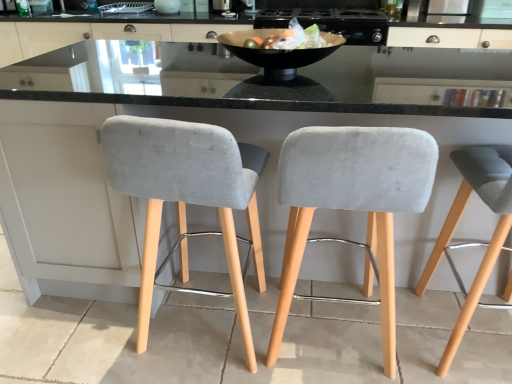
What do you see at coordinates (286, 100) in the screenshot? I see `matte white cabinet at upper center` at bounding box center [286, 100].

The height and width of the screenshot is (384, 512). I want to click on metallic black pan at upper center, placed as the first appliance when sorted from right to left, so click(332, 22).

Image resolution: width=512 pixels, height=384 pixels. What do you see at coordinates (277, 53) in the screenshot?
I see `black glossy bowl at center` at bounding box center [277, 53].

Locate an element on the screen. This screenshot has height=384, width=512. matte white cabinet at upper center is located at coordinates (286, 100).

Considering the positions of points (155, 5) and (280, 58), is point (155, 5) farther from camera compared to point (280, 58)?

Yes.

Between white glossy bowl at upper center, which is the first appliance in left-to-right order, and black glossy bowl at center, which one has larger width?

black glossy bowl at center.

From the image's perspective, does white glossy bowl at upper center, which is the 2th appliance in right-to-left order, appear lower than black glossy bowl at center?

Actually, white glossy bowl at upper center, which is the 2th appliance in right-to-left order, appears above black glossy bowl at center in the image.

How far apart are velvet grey chair at center, placed as the second chair when sorted from left to right, and matte white cabinet at upper center?

velvet grey chair at center, placed as the second chair when sorted from left to right, is 1.90 meters away from matte white cabinet at upper center.

How many degrees apart are the facing directions of velvet grey chair at center, placed as the second chair when sorted from left to right, and matte white cabinet at upper center?

They differ by 179 degrees in their facing directions.

Is velvet grey chair at center, placed as the second chair when sorted from left to right, directly adjacent to matte white cabinet at upper center?

There is a gap between velvet grey chair at center, placed as the second chair when sorted from left to right, and matte white cabinet at upper center.

From the image's perspective, which one is positioned higher, velvet grey chair at center, placed as the second chair when sorted from left to right, or matte white cabinet at upper center?

From the image's view, matte white cabinet at upper center is above.

In terms of height, does metallic black pan at upper center, which is counted as the 2th appliance, starting from the left, look taller or shorter compared to velvet grey chair at center, the 2th chair when ordered from right to left?

Considering their sizes, metallic black pan at upper center, which is counted as the 2th appliance, starting from the left, has less height than velvet grey chair at center, the 2th chair when ordered from right to left.

Locate an element on the screen. appliance that is the 1st object above the velvet grey chair at center, the 2th chair when ordered from right to left (from a real-world perspective) is located at coordinates (332, 22).

Looking at this image, from the image's perspective, which is above, metallic black pan at upper center, placed as the first appliance when sorted from right to left, or velvet grey chair at center, the 2th chair when ordered from right to left?

From the image's view, metallic black pan at upper center, placed as the first appliance when sorted from right to left, is above.

How many degrees apart are the facing directions of velvet grey chair at center, the 2th chair when ordered from right to left, and velvet grey bar stool at left, which appears as the 1th chair when viewed from the left?

1.62 degrees separate the facing orientations of velvet grey chair at center, the 2th chair when ordered from right to left, and velvet grey bar stool at left, which appears as the 1th chair when viewed from the left.

Considering the sizes of objects velvet grey chair at center, the 2th chair when ordered from right to left, and velvet grey bar stool at left, which appears as the 1th chair when viewed from the left, in the image provided, who is taller, velvet grey chair at center, the 2th chair when ordered from right to left, or velvet grey bar stool at left, which appears as the 1th chair when viewed from the left,?

velvet grey bar stool at left, which appears as the 1th chair when viewed from the left.

Considering the positions of objects velvet grey chair at center, the 2th chair when ordered from right to left, and velvet grey bar stool at left, the third chair when ordered from right to left, in the image provided, who is more to the right, velvet grey chair at center, the 2th chair when ordered from right to left, or velvet grey bar stool at left, the third chair when ordered from right to left,?

From the viewer's perspective, velvet grey chair at center, the 2th chair when ordered from right to left, appears more on the right side.

Considering the positions of point (368, 227) and point (129, 173), is point (368, 227) closer or farther from the camera than point (129, 173)?

Point (368, 227).

Does point (264, 10) appear closer or farther from the camera than point (282, 97)?

Clearly, point (264, 10) is more distant from the camera than point (282, 97).

Does metallic black pan at upper center, placed as the first appliance when sorted from right to left, have a larger size compared to matte white cabinet at upper center?

No.

Is metallic black pan at upper center, placed as the first appliance when sorted from right to left, to the left or to the right of matte white cabinet at upper center in the image?

Based on their positions, metallic black pan at upper center, placed as the first appliance when sorted from right to left, is located to the right of matte white cabinet at upper center.

From the image's perspective, is metallic black pan at upper center, which is counted as the 2th appliance, starting from the left, above or below matte white cabinet at upper center?

Clearly, from the image's perspective, metallic black pan at upper center, which is counted as the 2th appliance, starting from the left, is above matte white cabinet at upper center.

What's the angular difference between white glossy bowl at upper center, which is the 2th appliance in right-to-left order, and metallic black pan at upper center, placed as the first appliance when sorted from right to left,'s facing directions?

0.794 degrees.

Which object is wider, white glossy bowl at upper center, which is the first appliance in left-to-right order, or metallic black pan at upper center, which is counted as the 2th appliance, starting from the left?

Wider between the two is metallic black pan at upper center, which is counted as the 2th appliance, starting from the left.

Can you confirm if white glossy bowl at upper center, which is the 2th appliance in right-to-left order, is shorter than metallic black pan at upper center, which is counted as the 2th appliance, starting from the left?

Yes.

In the image, is white glossy bowl at upper center, which is the first appliance in left-to-right order, positioned in front of or behind metallic black pan at upper center, placed as the first appliance when sorted from right to left?

white glossy bowl at upper center, which is the first appliance in left-to-right order, is behind metallic black pan at upper center, placed as the first appliance when sorted from right to left.

Which is farther, [308,75] or [419,282]?

The point [308,75] is behind.

From the picture: Looking at the image, does matte white cabinet at upper center seem bigger or smaller compared to velvet grey bar stool at right, the 3th chair in the left-to-right sequence?

Considering their sizes, matte white cabinet at upper center takes up more space than velvet grey bar stool at right, the 3th chair in the left-to-right sequence.

Is matte white cabinet at upper center positioned with its back to velvet grey bar stool at right, the 3th chair in the left-to-right sequence?

No, matte white cabinet at upper center's orientation is not away from velvet grey bar stool at right, the 3th chair in the left-to-right sequence.

From the picture: Can you confirm if matte white cabinet at upper center is taller than velvet grey bar stool at right, the 3th chair in the left-to-right sequence?

Incorrect, the height of matte white cabinet at upper center is not larger of that of velvet grey bar stool at right, the 3th chair in the left-to-right sequence.

You are a GUI agent. You are given a task and a screenshot of the screen. Output one action in this format:
    pyautogui.click(x=<x>, y=<y>)
    Task: Click on the appliance on the left of black glossy bowl at center
    
    Given the screenshot: What is the action you would take?
    pyautogui.click(x=167, y=6)

You are a GUI agent. You are given a task and a screenshot of the screen. Output one action in this format:
    pyautogui.click(x=<x>, y=<y>)
    Task: Click on the cabinetry above the velvet grey chair at center, placed as the second chair when sorted from left to right (from a real-world perspective)
    The height and width of the screenshot is (384, 512).
    Given the screenshot: What is the action you would take?
    pyautogui.click(x=286, y=100)

Considering their positions, is matte white cabinet at upper center positioned closer to black glossy bowl at center than velvet grey chair at center, the 2th chair when ordered from right to left?

velvet grey chair at center, the 2th chair when ordered from right to left, is positioned closer to the anchor black glossy bowl at center.

When comparing their distances from metallic black pan at upper center, placed as the first appliance when sorted from right to left, does velvet grey bar stool at left, the third chair when ordered from right to left, or velvet grey chair at center, the 2th chair when ordered from right to left, seem closer?

velvet grey bar stool at left, the third chair when ordered from right to left, is positioned closer to the anchor metallic black pan at upper center, placed as the first appliance when sorted from right to left.

Considering their positions, is matte white cabinet at upper center positioned further to velvet grey chair at center, placed as the second chair when sorted from left to right, than metallic black pan at upper center, placed as the first appliance when sorted from right to left?

matte white cabinet at upper center is positioned further to the anchor velvet grey chair at center, placed as the second chair when sorted from left to right.

From the image, which object appears to be nearer to black glossy bowl at center, velvet grey chair at center, the 2th chair when ordered from right to left, or white glossy bowl at upper center, which is the first appliance in left-to-right order?

velvet grey chair at center, the 2th chair when ordered from right to left, lies closer to black glossy bowl at center than the other object.

In the scene shown: Looking at the image, which one is located further to matte white cabinet at upper center, velvet grey chair at center, the 2th chair when ordered from right to left, or velvet grey bar stool at right, which is the 1th chair in right-to-left order?

velvet grey bar stool at right, which is the 1th chair in right-to-left order, is positioned further to the anchor matte white cabinet at upper center.

Considering their positions, is matte white cabinet at upper center positioned closer to black glossy bowl at center than white glossy bowl at upper center, which is the 2th appliance in right-to-left order?

matte white cabinet at upper center is positioned closer to the anchor black glossy bowl at center.

Looking at the image, which one is located further to metallic black pan at upper center, placed as the first appliance when sorted from right to left, velvet grey chair at center, placed as the second chair when sorted from left to right, or velvet grey bar stool at left, which appears as the 1th chair when viewed from the left?

velvet grey chair at center, placed as the second chair when sorted from left to right, lies further to metallic black pan at upper center, placed as the first appliance when sorted from right to left, than the other object.

Based on their spatial positions, is velvet grey chair at center, the 2th chair when ordered from right to left, or velvet grey bar stool at right, which is the 1th chair in right-to-left order, closer to black glossy bowl at center?

The object closer to black glossy bowl at center is velvet grey chair at center, the 2th chair when ordered from right to left.

You are a GUI agent. You are given a task and a screenshot of the screen. Output one action in this format:
    pyautogui.click(x=<x>, y=<y>)
    Task: Click on the cabinetry between velvet grey bar stool at right, the 3th chair in the left-to-right sequence, and white glossy bowl at upper center, which is the 2th appliance in right-to-left order, in the front-back direction
    Image resolution: width=512 pixels, height=384 pixels.
    Given the screenshot: What is the action you would take?
    pyautogui.click(x=286, y=100)

Identify the location of appliance located between black glossy bowl at center and white glossy bowl at upper center, which is the first appliance in left-to-right order, in the depth direction. (332, 22).

Image resolution: width=512 pixels, height=384 pixels. In order to click on appliance located between velvet grey chair at center, the 2th chair when ordered from right to left, and white glossy bowl at upper center, which is the first appliance in left-to-right order, in the depth direction in this screenshot , I will do `click(332, 22)`.

Where is `bowl between velvet grey chair at center, the 2th chair when ordered from right to left, and metallic black pan at upper center, which is counted as the 2th appliance, starting from the left, from front to back`? Image resolution: width=512 pixels, height=384 pixels. bowl between velvet grey chair at center, the 2th chair when ordered from right to left, and metallic black pan at upper center, which is counted as the 2th appliance, starting from the left, from front to back is located at coordinates (277, 53).